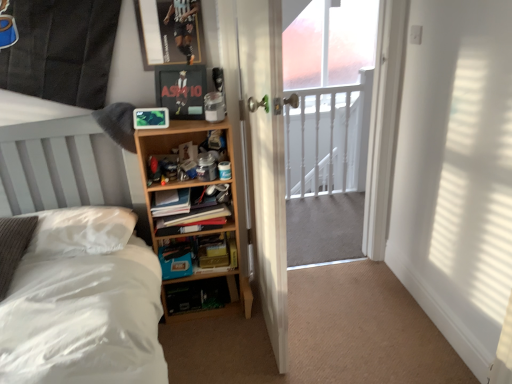
Question: Is wooden shelf at center thinner than hardcover book at center?

Choices:
 (A) no
 (B) yes

Answer: (A)

Question: Is the position of wooden shelf at center more distant than that of hardcover book at center?

Choices:
 (A) no
 (B) yes

Answer: (A)

Question: Considering the relative positions of wooden shelf at center and hardcover book at center in the image provided, is wooden shelf at center to the right of hardcover book at center from the viewer's perspective?

Choices:
 (A) yes
 (B) no

Answer: (B)

Question: From the image's perspective, is wooden shelf at center on hardcover book at center?

Choices:
 (A) no
 (B) yes

Answer: (B)

Question: From a real-world perspective, is wooden shelf at center on hardcover book at center?

Choices:
 (A) yes
 (B) no

Answer: (A)

Question: Based on their positions, is white wooden door at center located to the left or right of metallic silver picture frame at upper center, the first picture frame viewed from the top?

Choices:
 (A) left
 (B) right

Answer: (B)

Question: From their relative heights in the image, would you say white wooden door at center is taller or shorter than metallic silver picture frame at upper center, the first picture frame viewed from the top?

Choices:
 (A) short
 (B) tall

Answer: (B)

Question: Is white wooden door at center inside the boundaries of metallic silver picture frame at upper center, the first picture frame viewed from the top, or outside?

Choices:
 (A) inside
 (B) outside

Answer: (B)

Question: From the image's perspective, relative to metallic silver picture frame at upper center, the first picture frame viewed from the top, is white wooden door at center above or below?

Choices:
 (A) below
 (B) above

Answer: (A)

Question: Considering the positions of clear glass screen door at center and white glossy railings at center in the image, is clear glass screen door at center taller or shorter than white glossy railings at center?

Choices:
 (A) tall
 (B) short

Answer: (A)

Question: Relative to white glossy railings at center, is clear glass screen door at center in front or behind?

Choices:
 (A) front
 (B) behind

Answer: (A)

Question: Considering the positions of point (289, 226) and point (325, 183), is point (289, 226) closer or farther from the camera than point (325, 183)?

Choices:
 (A) farther
 (B) closer

Answer: (B)

Question: Looking at their shapes, would you say clear glass screen door at center is wider or thinner than white glossy railings at center?

Choices:
 (A) thin
 (B) wide

Answer: (B)

Question: Based on their positions, is matte black picture frame at upper center, which is counted as the first picture frame, starting from the bottom, located to the left or right of wooden bookshelf at center?

Choices:
 (A) right
 (B) left

Answer: (B)

Question: In terms of height, does matte black picture frame at upper center, the 2th picture frame positioned from the top, look taller or shorter compared to wooden bookshelf at center?

Choices:
 (A) short
 (B) tall

Answer: (B)